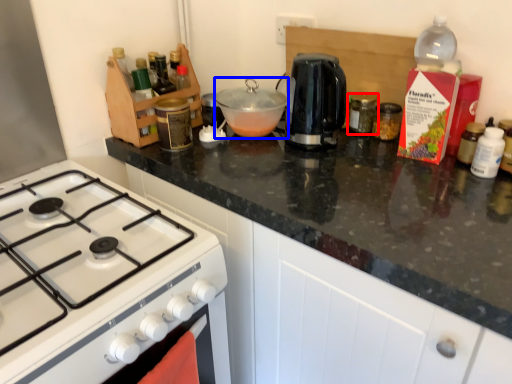
Question: Which object is further to the camera taking this photo, kitchen appliance (highlighted by a red box) or kitchen appliance (highlighted by a blue box)?

Choices:
 (A) kitchen appliance
 (B) kitchen appliance

Answer: (A)